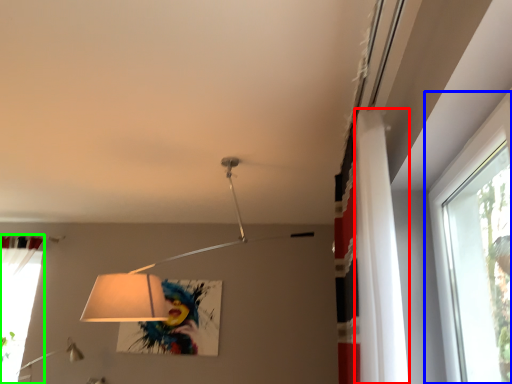
Question: Considering the real-world distances, which object is farthest from curtain (highlighted by a red box)? window (highlighted by a blue box) or curtain (highlighted by a green box)?

Choices:
 (A) window
 (B) curtain

Answer: (B)